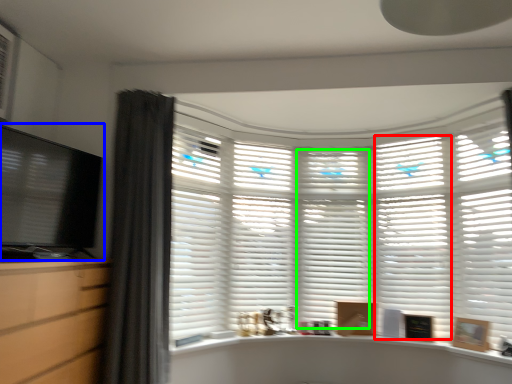
Question: Estimate the real-world distances between objects in this image. Which object is farther from shutter (highlighted by a red box), computer monitor (highlighted by a blue box) or shutter (highlighted by a green box)?

Choices:
 (A) computer monitor
 (B) shutter

Answer: (A)